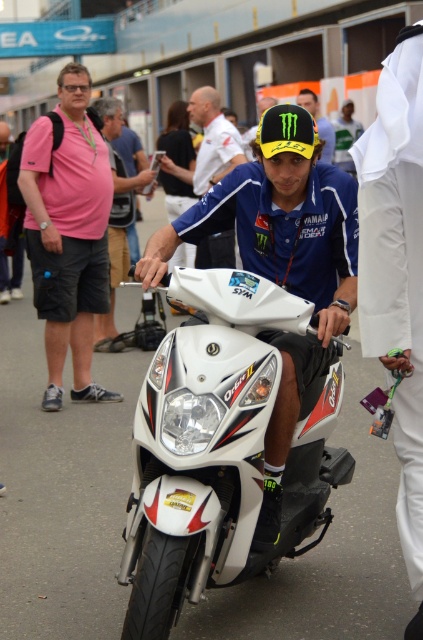
You are a photographer at the event and want to capture a photo of the pink cotton shirt at left. Where should you aim your camera?

You should aim your camera at point (68,234) to capture the pink cotton shirt at left.

You are standing at the camera position and want to know how far the point at coordinate point (417, 99) is from you. Can you determine the distance?

The point at coordinate point (417, 99) is 3.23 meters away from the camera, so the distance is 3.23 meters.

You are a photographer standing at the center of the event. You want to take a photo of the white glossy motorcycle at center and the pink cotton shirt at left. However, you have a camera with a 50mm lens that has a maximum focusing distance of 3 meters. Will both subjects be in focus?

The white glossy motorcycle at center is 3.29 meters away from the pink cotton shirt at left. Since the camera can only focus up to 3 meters, the distance between them exceeds the maximum focusing distance. Therefore, both subjects cannot be in focus simultaneously.